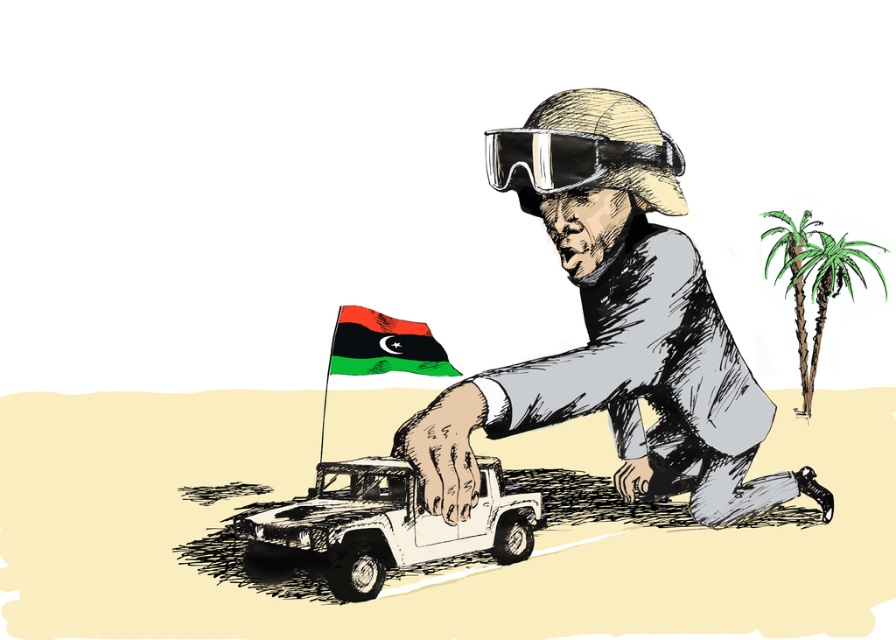
Who is positioned more to the right, clear plastic goggles at upper center or green textured palm tree at right?

From the viewer's perspective, green textured palm tree at right appears more on the right side.

How distant is clear plastic goggles at upper center from green textured palm tree at right?

clear plastic goggles at upper center and green textured palm tree at right are 23.91 feet apart from each other.

Is point (509, 170) closer to viewer compared to point (765, 259)?

Yes, point (509, 170) is in front of point (765, 259).

You are a GUI agent. You are given a task and a screenshot of the screen. Output one action in this format:
    pyautogui.click(x=<x>, y=<y>)
    Task: Click on the clear plastic goggles at upper center
    Image resolution: width=896 pixels, height=640 pixels.
    Given the screenshot: What is the action you would take?
    pyautogui.click(x=566, y=157)

Who is shorter, green textured palm tree at right or green leafy palm tree at right?

green textured palm tree at right

Locate an element on the screen. green textured palm tree at right is located at coordinates (x=817, y=284).

Does point (872, 262) come closer to viewer compared to point (810, 356)?

Yes.

This screenshot has height=640, width=896. I want to click on green textured palm tree at right, so click(817, 284).

Can you confirm if white matte truck at center is smaller than green matte flag at center?

No, white matte truck at center is not smaller than green matte flag at center.

The width and height of the screenshot is (896, 640). Describe the element at coordinates (381, 525) in the screenshot. I see `white matte truck at center` at that location.

Is point (450, 541) positioned behind point (376, 356)?

That is False.

Locate an element on the screen. white matte truck at center is located at coordinates (381, 525).